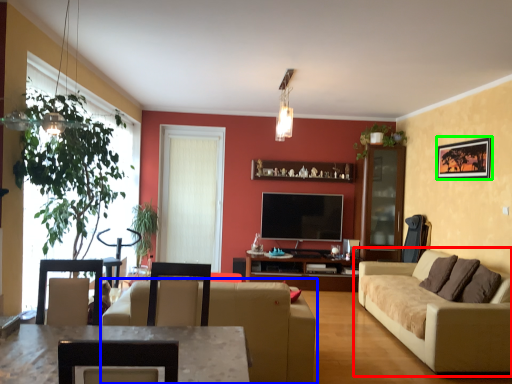
Question: Which object is positioned closest to studio couch (highlighted by a red box)? Select from studio couch (highlighted by a blue box) and picture frame (highlighted by a green box).

Choices:
 (A) studio couch
 (B) picture frame

Answer: (A)